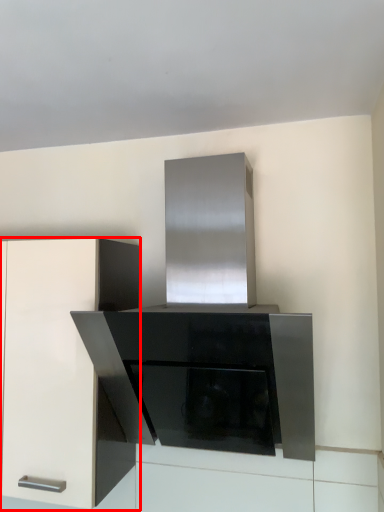
Question: From the image's perspective, considering the relative positions of cabinetry (annotated by the red box) and appliance in the image provided, where is cabinetry (annotated by the red box) located with respect to the staircase?

Choices:
 (A) below
 (B) above

Answer: (A)